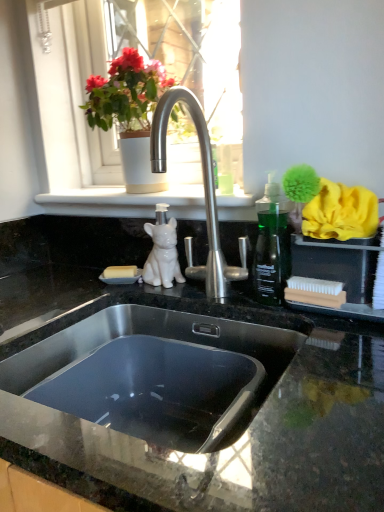
Question: Is stainless steel sink at center oriented away from matte white pot at upper center?

Choices:
 (A) no
 (B) yes

Answer: (A)

Question: From the image's perspective, does stainless steel sink at center appear lower than matte white pot at upper center?

Choices:
 (A) yes
 (B) no

Answer: (A)

Question: Is stainless steel sink at center wider than matte white pot at upper center?

Choices:
 (A) yes
 (B) no

Answer: (A)

Question: Does stainless steel sink at center turn towards matte white pot at upper center?

Choices:
 (A) no
 (B) yes

Answer: (A)

Question: Does stainless steel sink at center appear on the right side of matte white pot at upper center?

Choices:
 (A) no
 (B) yes

Answer: (B)

Question: Are stainless steel sink at center and matte white pot at upper center making contact?

Choices:
 (A) no
 (B) yes

Answer: (A)

Question: Can you see white ceramic pot at upper center touching matte white pot at upper center?

Choices:
 (A) no
 (B) yes

Answer: (A)

Question: Does white ceramic pot at upper center contain matte white pot at upper center?

Choices:
 (A) yes
 (B) no

Answer: (A)

Question: Is white ceramic pot at upper center not close to matte white pot at upper center?

Choices:
 (A) yes
 (B) no

Answer: (B)

Question: Does white ceramic pot at upper center have a larger size compared to matte white pot at upper center?

Choices:
 (A) yes
 (B) no

Answer: (A)

Question: Is matte white pot at upper center at the back of white ceramic pot at upper center?

Choices:
 (A) no
 (B) yes

Answer: (B)

Question: Does white ceramic pot at upper center have a smaller size compared to matte white pot at upper center?

Choices:
 (A) yes
 (B) no

Answer: (B)

Question: From the image's perspective, is black granite countertop at center below white glossy dog at center?

Choices:
 (A) yes
 (B) no

Answer: (A)